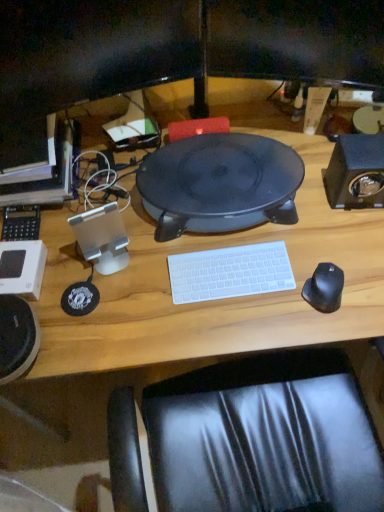
Locate an element on the screen. vacant area in front of white plastic keyboard at center is located at coordinates (231, 325).